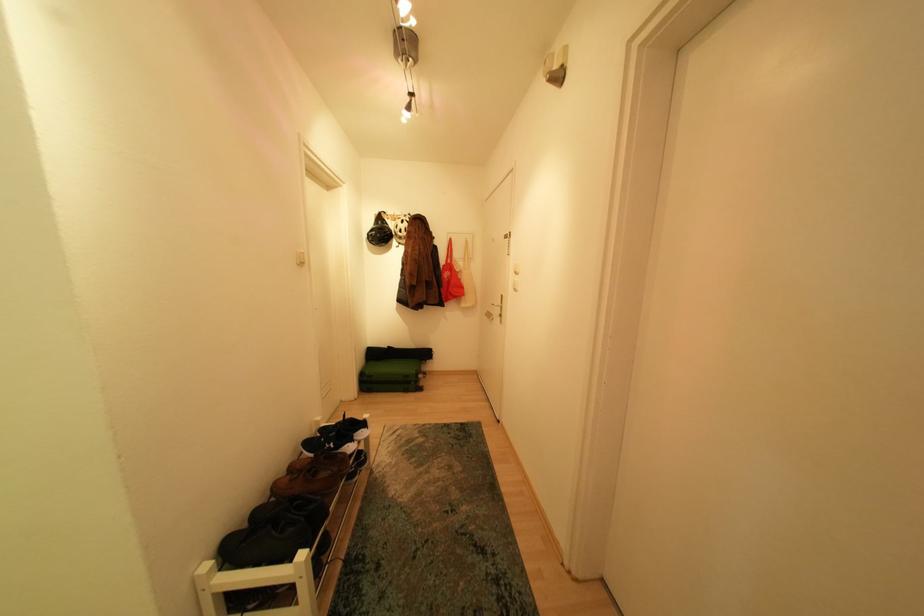
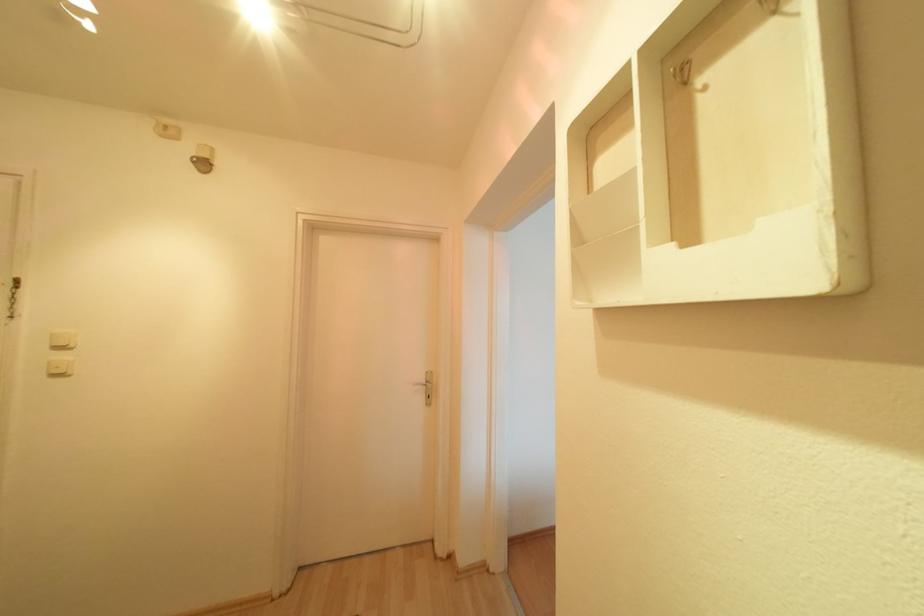
Question: The images are taken continuously from a first-person perspective. In which direction is your viewpoint rotating?

Choices:
 (A) Left
 (B) Right
 (C) Up
 (D) Down

Answer: (B)